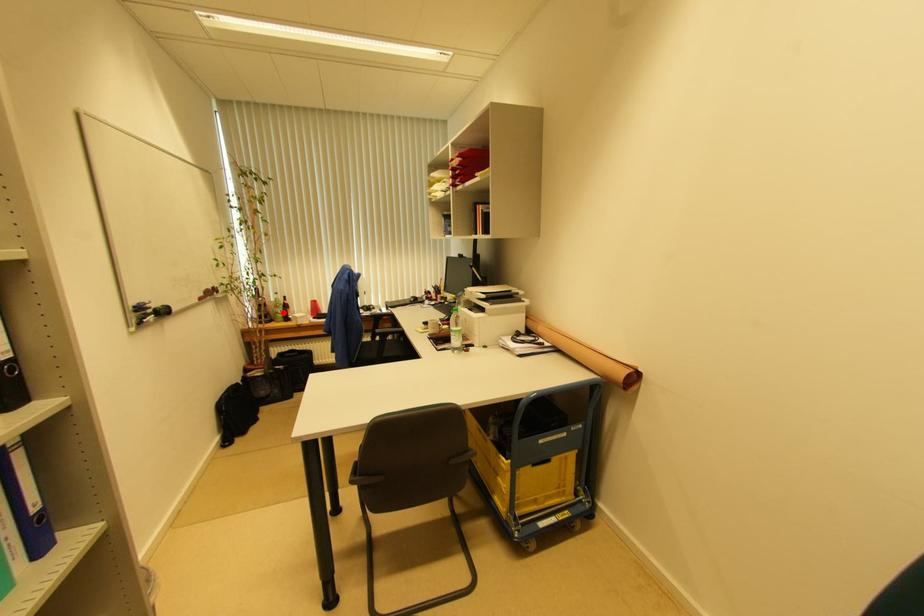
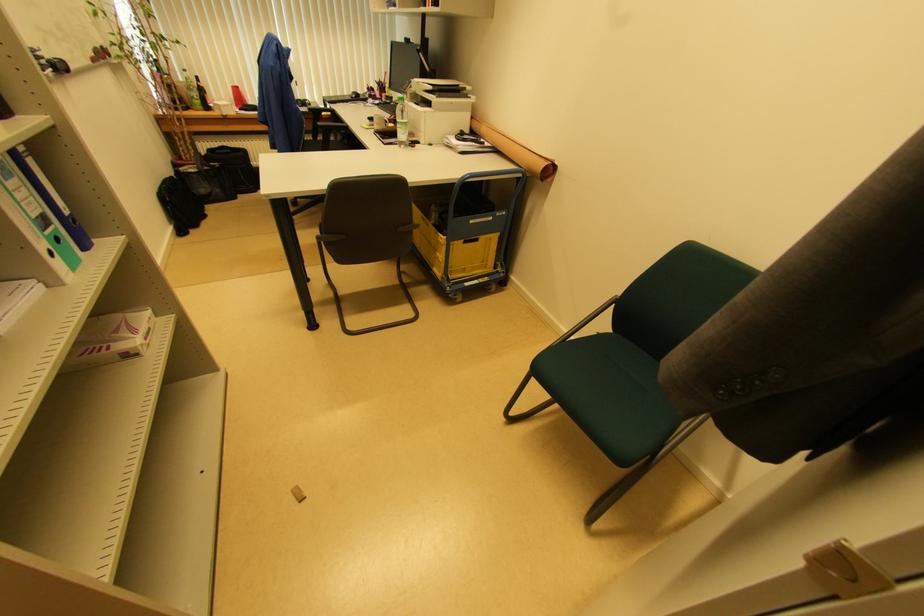
Question: I am providing you with two images of the same scene from different viewpoints. Image1 has a red point marked. In image2, the corresponding 3D location appears at what relative position? Reply with the corresponding letter.

Choices:
 (A) Closer
 (B) Farther

Answer: (B)